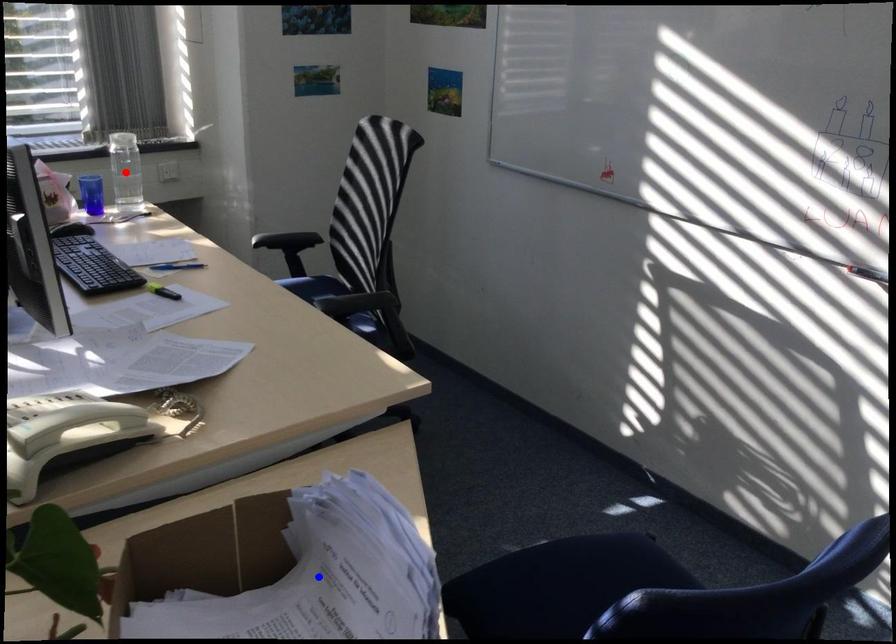
Question: In the image, two points are highlighted. Which point is nearer to the camera? Reply with the corresponding letter.

Choices:
 (A) blue point
 (B) red point

Answer: (A)